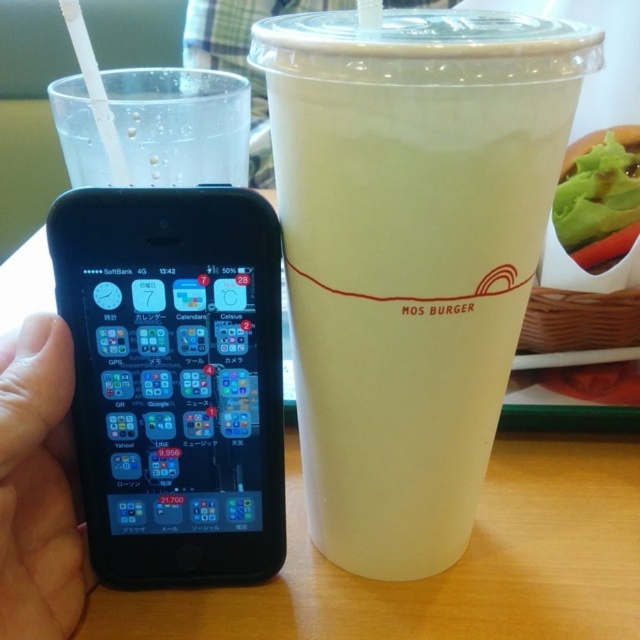
Identify the location of black matte smartphone at left. This screenshot has height=640, width=640. click(173, 380).

Is black matte smartphone at left shorter than white plastic straw at upper left?

No, black matte smartphone at left is not shorter than white plastic straw at upper left.

Identify the location of black matte smartphone at left. (173, 380).

Is point (10, 378) less distant than point (598, 248)?

Yes, it is in front of point (598, 248).

This screenshot has height=640, width=640. What do you see at coordinates (38, 484) in the screenshot?
I see `matte black phone at lower left` at bounding box center [38, 484].

Identify the location of matte black phone at lower left. This screenshot has width=640, height=640. (38, 484).

Locate an element on the screen. matte black phone at lower left is located at coordinates 38,484.

Can you confirm if matte black phone at lower left is taller than white plastic straw at upper left?

Yes.

Who is more distant from viewer, (35, 618) or (90, 61)?

The point (90, 61) is behind.

Locate an element on the screen. The height and width of the screenshot is (640, 640). matte black phone at lower left is located at coordinates (38, 484).